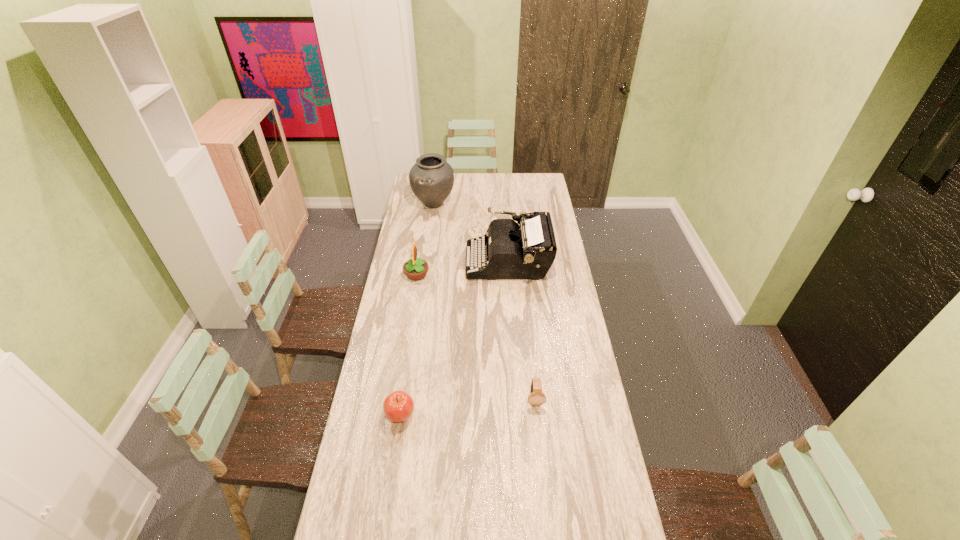
Find the location of a particular element. vacant region located on the face of the third shortest object is located at coordinates (510, 275).

Locate an element on the screen. The width and height of the screenshot is (960, 540). vacant space situated 0.110m on the face of the watch is located at coordinates (539, 438).

The height and width of the screenshot is (540, 960). What are the coordinates of `vacant space situated 0.160m on the front of the apple` in the screenshot? It's located at (392, 476).

I want to click on object present at the far edge, so click(x=431, y=178).

Where is `urn present at the left edge`? This screenshot has height=540, width=960. urn present at the left edge is located at coordinates (431, 178).

Locate an element on the screen. This screenshot has width=960, height=540. sunflower located in the left edge section of the desktop is located at coordinates (x=415, y=269).

You are a GUI agent. You are given a task and a screenshot of the screen. Output one action in this format:
    pyautogui.click(x=<x>, y=<y>)
    Task: Click on the apple that is at the left edge
    This screenshot has width=960, height=540.
    Given the screenshot: What is the action you would take?
    pyautogui.click(x=398, y=406)

Locate an element on the screen. This screenshot has width=960, height=540. object that is at the right edge is located at coordinates (526, 249).

Find the location of `object located in the far left corner section of the desktop`. object located in the far left corner section of the desktop is located at coordinates (431, 178).

This screenshot has height=540, width=960. What are the coordinates of `vacant space at the far edge` in the screenshot? It's located at (479, 186).